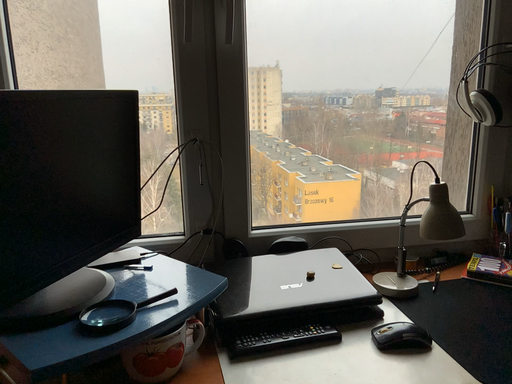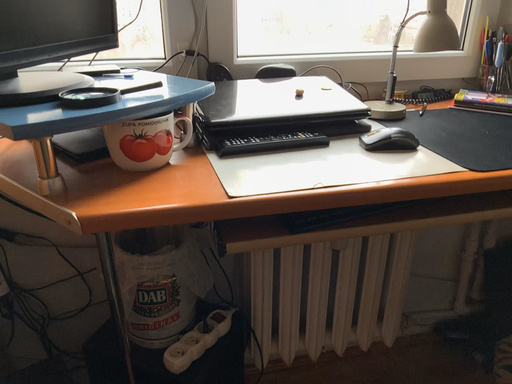
Question: Which way did the camera rotate in the video?

Choices:
 (A) rotated downward
 (B) rotated upward

Answer: (A)